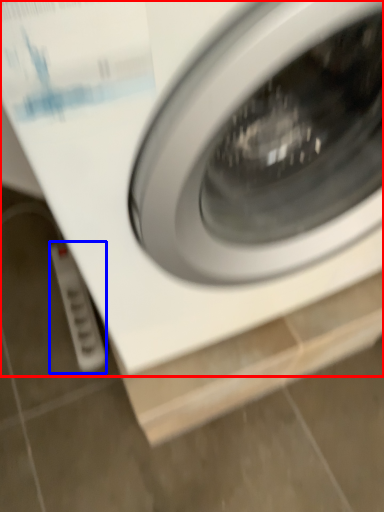
Question: Among these objects, which one is farthest to the camera, washing machine (highlighted by a red box) or electric outlet (highlighted by a blue box)?

Choices:
 (A) washing machine
 (B) electric outlet

Answer: (B)